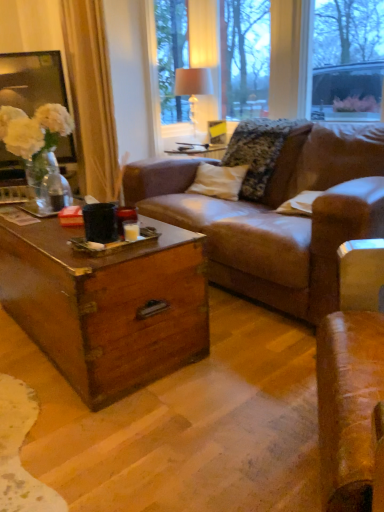
Question: Does beige fabric curtain at left touch matte glass vase at upper center?

Choices:
 (A) no
 (B) yes

Answer: (A)

Question: Is beige fabric curtain at left located outside matte glass vase at upper center?

Choices:
 (A) yes
 (B) no

Answer: (A)

Question: Is beige fabric curtain at left not near matte glass vase at upper center?

Choices:
 (A) no
 (B) yes

Answer: (A)

Question: Can you confirm if beige fabric curtain at left is wider than matte glass vase at upper center?

Choices:
 (A) no
 (B) yes

Answer: (B)

Question: Is beige fabric curtain at left positioned behind matte glass vase at upper center?

Choices:
 (A) no
 (B) yes

Answer: (B)

Question: Considering the positions of beige fabric curtain at left and fluffy fabric pillow at center in the image, is beige fabric curtain at left wider or thinner than fluffy fabric pillow at center?

Choices:
 (A) wide
 (B) thin

Answer: (B)

Question: From the image's perspective, is beige fabric curtain at left located above or below fluffy fabric pillow at center?

Choices:
 (A) above
 (B) below

Answer: (A)

Question: Is beige fabric curtain at left in front of or behind fluffy fabric pillow at center in the image?

Choices:
 (A) front
 (B) behind

Answer: (A)

Question: In terms of height, does beige fabric curtain at left look taller or shorter compared to fluffy fabric pillow at center?

Choices:
 (A) tall
 (B) short

Answer: (A)

Question: Is white fabric lampshade at upper center inside the boundaries of fluffy fabric pillow at center, or outside?

Choices:
 (A) inside
 (B) outside

Answer: (B)

Question: In terms of height, does white fabric lampshade at upper center look taller or shorter compared to fluffy fabric pillow at center?

Choices:
 (A) short
 (B) tall

Answer: (B)

Question: From a real-world perspective, is white fabric lampshade at upper center physically located above or below fluffy fabric pillow at center?

Choices:
 (A) above
 (B) below

Answer: (A)

Question: Considering their positions, is white fabric lampshade at upper center located in front of or behind fluffy fabric pillow at center?

Choices:
 (A) front
 (B) behind

Answer: (B)

Question: Is white fabric lampshade at upper center wider or thinner than beige fabric curtain at left?

Choices:
 (A) thin
 (B) wide

Answer: (A)

Question: From the image's perspective, relative to beige fabric curtain at left, is white fabric lampshade at upper center above or below?

Choices:
 (A) below
 (B) above

Answer: (B)